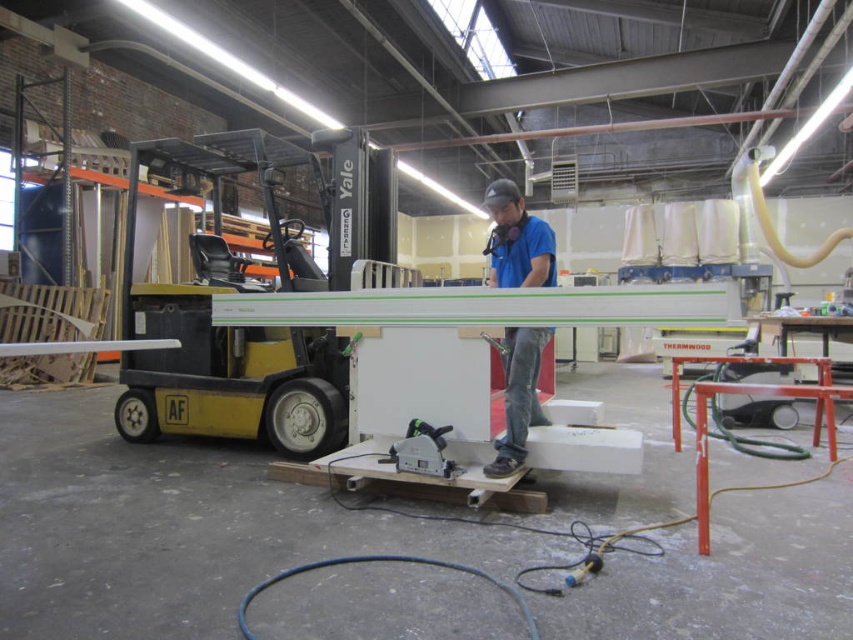
You are a delivery person who needs to place a package at point (517, 241) in the workshop. There is a blue cotton shirt at center. Can you safely place the package there?

The blue cotton shirt at center is located at point (517, 241), so placing the package there would require moving the shirt first.

You are standing in the workshop and see the point at coordinates (234,324). Which object is this point located on?

The point at coordinates (234,324) is located on the yellow black plastic forklift at left.